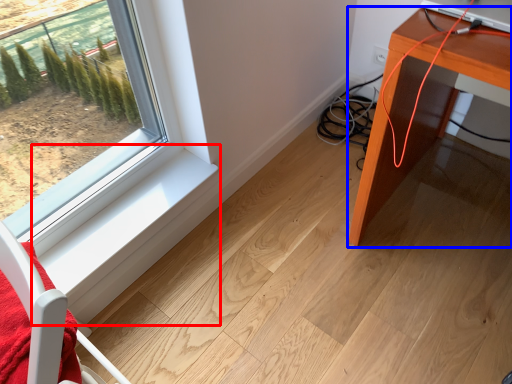
Question: Among these objects, which one is farthest to the camera, window sill (highlighted by a red box) or table (highlighted by a blue box)?

Choices:
 (A) window sill
 (B) table

Answer: (A)